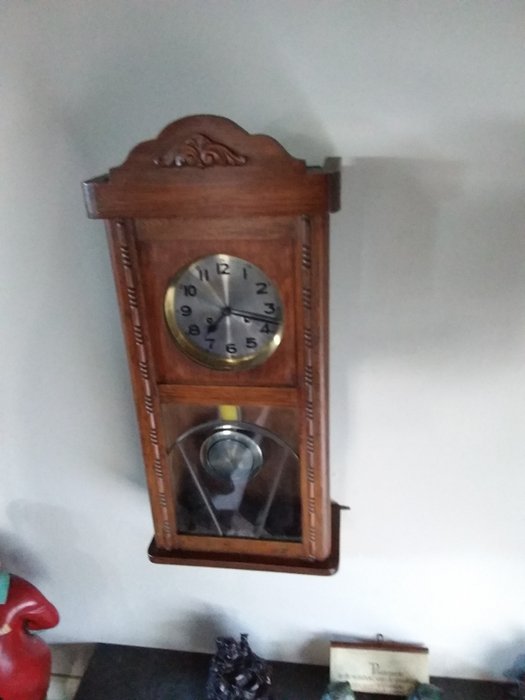
Identify the location of vase. (26, 645).